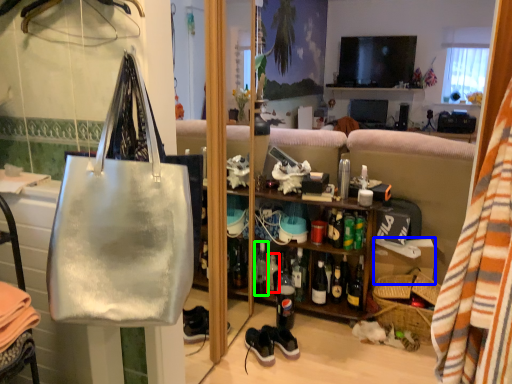
Question: Based on their relative distances, which object is farther from bottle (highlighted by a red box)? Choose from box (highlighted by a blue box) and bottle (highlighted by a green box).

Choices:
 (A) box
 (B) bottle

Answer: (A)